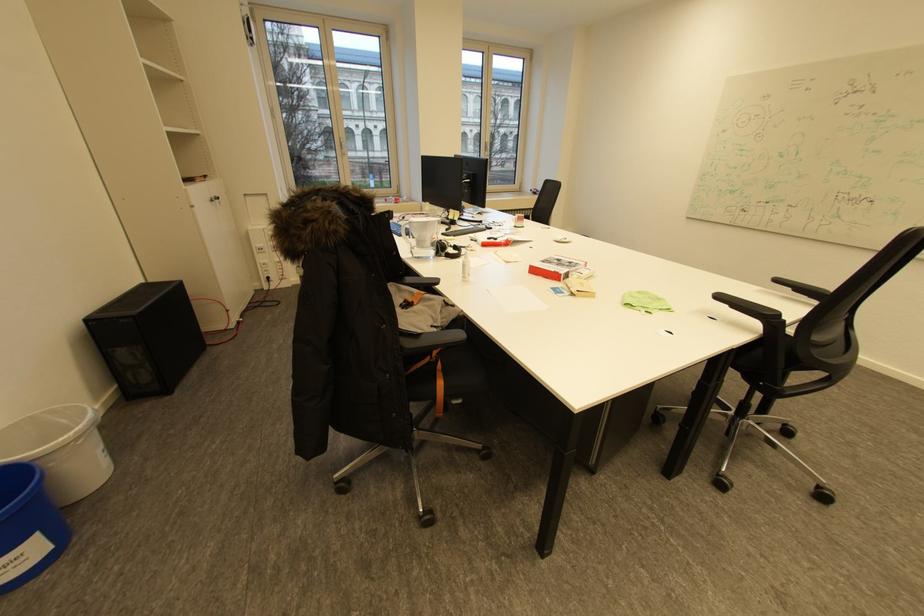
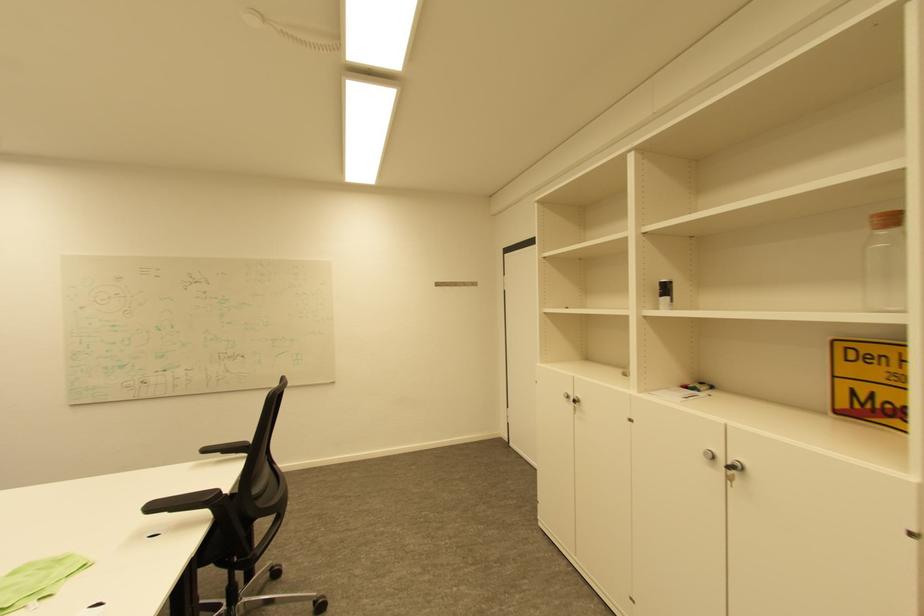
Locate, in the second image, the point that corresponds to the point at 784,282 in the first image.

(213, 450)